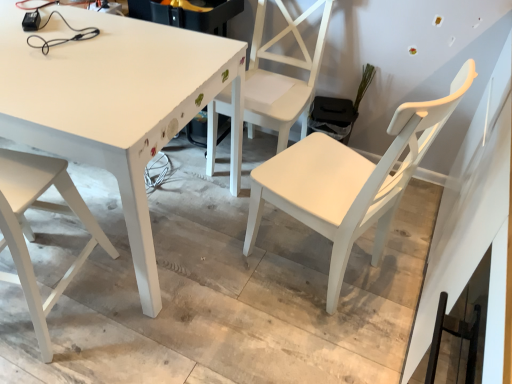
At what (x,y) coordinates should I click in order to perform the action: click on spots to the right of white matte chair at lower left, marked as the first chair in a left-to-right arrangement. Please return your answer as a coordinate pair (x, y). Looking at the image, I should click on (140, 306).